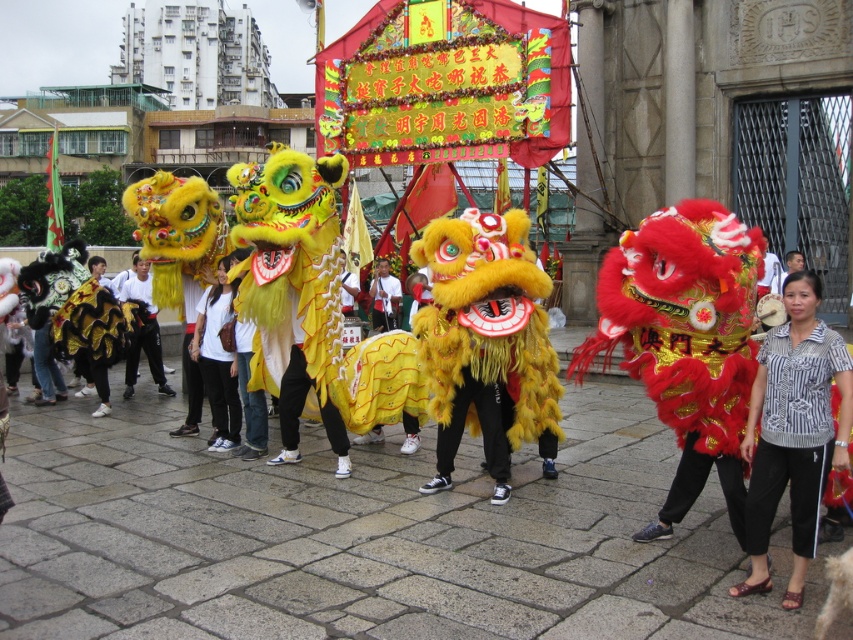
You are a photographer trying to capture a photo of the lion dance performers. You notice two shirts at the center of the scene. Which shirt is narrower between the striped shirt at center and the white cotton shirt at center?

The striped shirt at center is narrower than the white cotton shirt at center according to the description.

You are a photographer trying to capture the lion dance performance. You notice the yellow fuzzy lion at center and the striped shirt at center. Which object should you focus on if you want to take a photo that emphasizes the size difference between them?

You should focus on the yellow fuzzy lion at center because it has a larger size compared to the striped shirt at center, making the size difference more prominent in the photo.